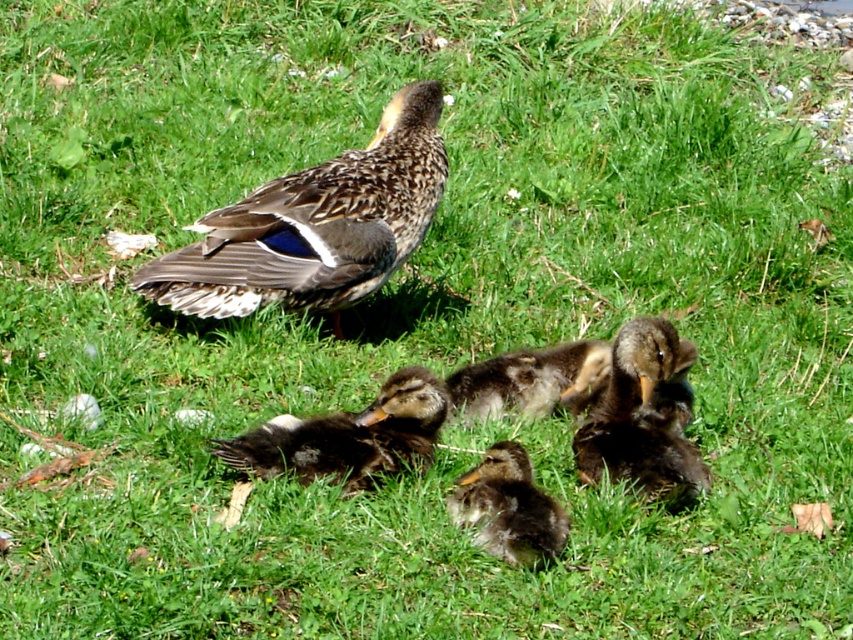
Question: Based on their relative distances, which object is farther from the dark brown downy duckling at center?

Choices:
 (A) brown speckled duck at upper left
 (B) dark brown fuzzy duckling at center
 (C) brown fluffy duckling at center

Answer: (A)

Question: Which object appears closest to the camera in this image?

Choices:
 (A) dark brown fluffy duckling at center
 (B) brown speckled duck at upper left
 (C) brown fluffy duckling at center
 (D) dark brown fuzzy duckling at center

Answer: (D)

Question: Is dark brown fluffy duckling at center smaller than dark brown downy duckling at center?

Choices:
 (A) yes
 (B) no

Answer: (B)

Question: Which point appears closest to the camera in this image?

Choices:
 (A) (538, 413)
 (B) (525, 506)

Answer: (B)

Question: Can you confirm if brown speckled duck at upper left is wider than dark brown fluffy duckling at center?

Choices:
 (A) no
 (B) yes

Answer: (B)

Question: Is dark brown fluffy duckling at center positioned before dark brown downy duckling at center?

Choices:
 (A) yes
 (B) no

Answer: (B)